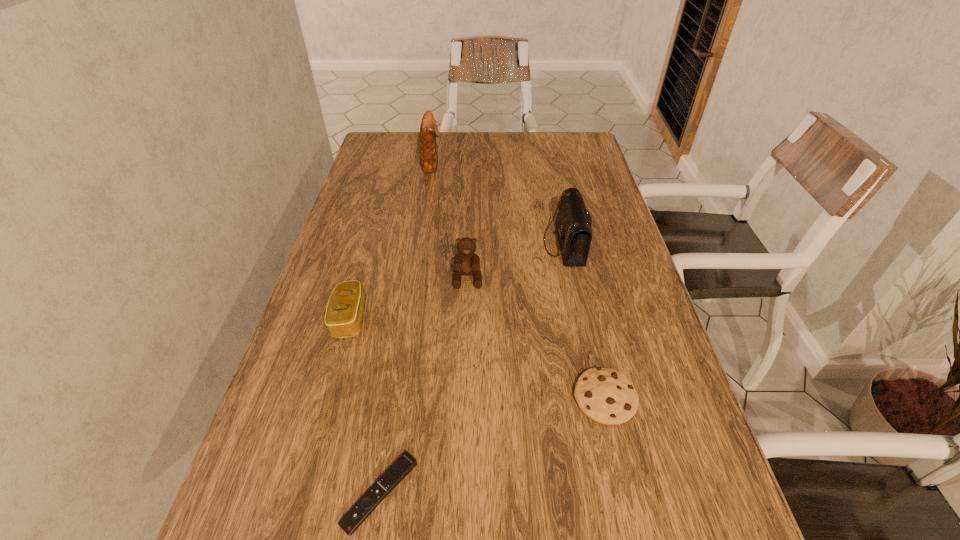
Locate an element on the screen. the tallest object is located at coordinates (429, 131).

You are a GUI agent. You are given a task and a screenshot of the screen. Output one action in this format:
    pyautogui.click(x=<x>, y=<y>)
    Task: Click on the second clutch bag from right to left
    
    Given the screenshot: What is the action you would take?
    429,131

Locate an element on the screen. the second nearest clutch bag is located at coordinates (573, 224).

This screenshot has width=960, height=540. In order to click on the second farthest object in this screenshot , I will do `click(573, 224)`.

Where is `the fourth object from left to right`? The width and height of the screenshot is (960, 540). the fourth object from left to right is located at coordinates (466, 262).

Image resolution: width=960 pixels, height=540 pixels. Identify the location of the third farthest object. [x=466, y=262].

The width and height of the screenshot is (960, 540). I want to click on the shortest clutch bag, so click(344, 314).

Locate an element on the screen. the leftmost clutch bag is located at coordinates (344, 314).

Find the location of a particular element. The image size is (960, 540). the fifth farthest object is located at coordinates click(605, 395).

Find the location of `the fifth tallest object`. the fifth tallest object is located at coordinates (605, 395).